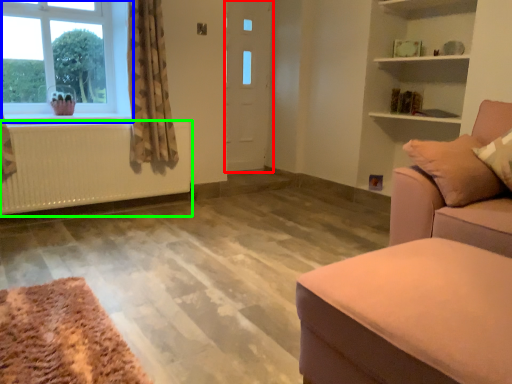
Question: Based on their relative distances, which object is nearer to door (highlighted by a red box)? Choose from window (highlighted by a blue box) and radiator (highlighted by a green box).

Choices:
 (A) window
 (B) radiator

Answer: (B)